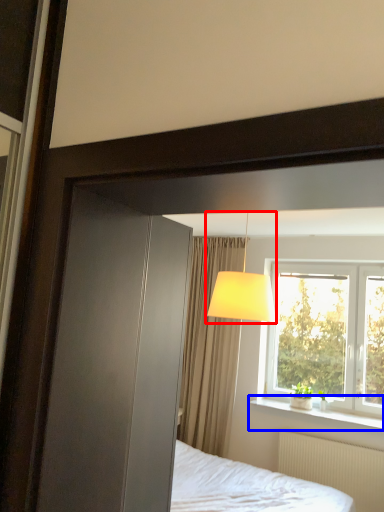
Question: Which object appears farthest to the camera in this image, table lamp (highlighted by a red box) or window sill (highlighted by a blue box)?

Choices:
 (A) table lamp
 (B) window sill

Answer: (B)